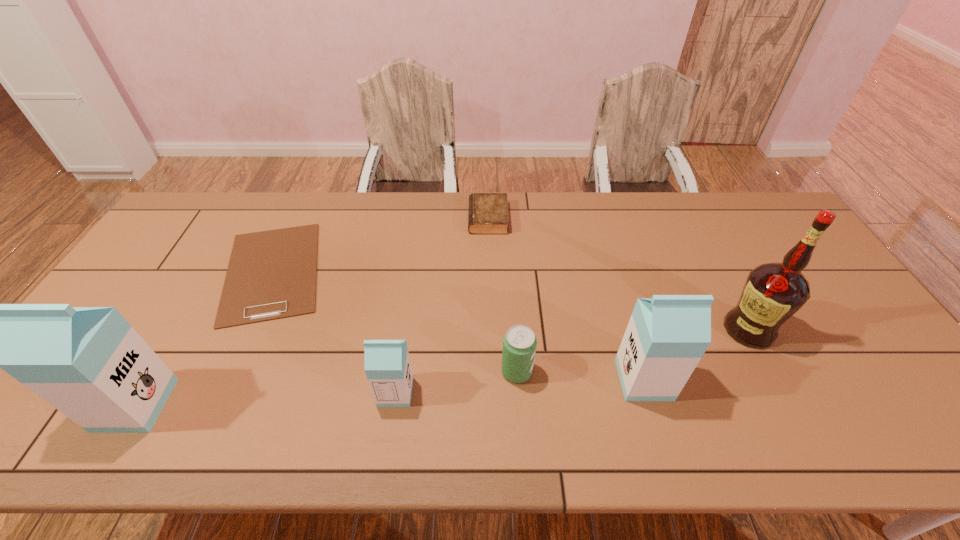
Find the location of a particular element. Image resolution: width=960 pixels, height=540 pixels. free point that keeps the milk cartons evenly spaced on the right is located at coordinates (881, 368).